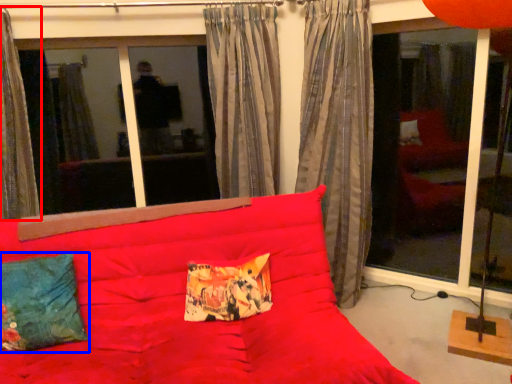
Question: Which point is closer to the camera, curtain (highlighted by a red box) or pillow (highlighted by a blue box)?

Choices:
 (A) curtain
 (B) pillow

Answer: (B)